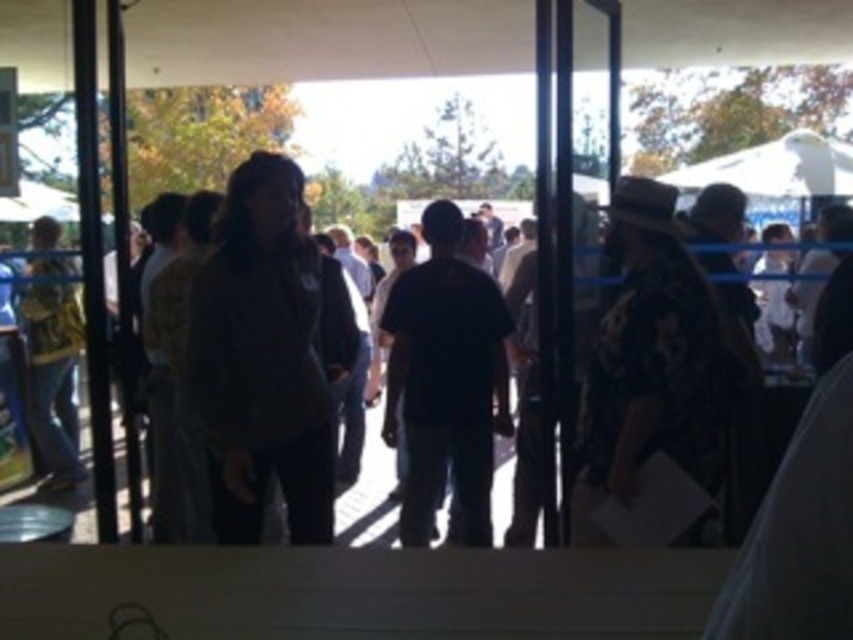
Question: Observing the image, what is the correct spatial positioning of black matte shirt at center in reference to transparent glass door at center?

Choices:
 (A) below
 (B) above

Answer: (A)

Question: Considering the relative positions of transparent glass door at center and dark gray jacket at center in the image provided, where is transparent glass door at center located with respect to dark gray jacket at center?

Choices:
 (A) above
 (B) below

Answer: (A)

Question: Which point is farther to the camera?

Choices:
 (A) (556, 381)
 (B) (85, 504)
 (C) (496, 412)

Answer: (B)

Question: Which object is the farthest from the transparent glass door at center?

Choices:
 (A) dark gray jacket at center
 (B) black matte shirt at center

Answer: (A)

Question: Among these points, which one is nearest to the camera?

Choices:
 (A) (361, 476)
 (B) (430, 493)
 (C) (558, 168)

Answer: (C)

Question: From the image, what is the correct spatial relationship of transparent glass door at center in relation to dark gray jacket at center?

Choices:
 (A) above
 (B) below

Answer: (A)